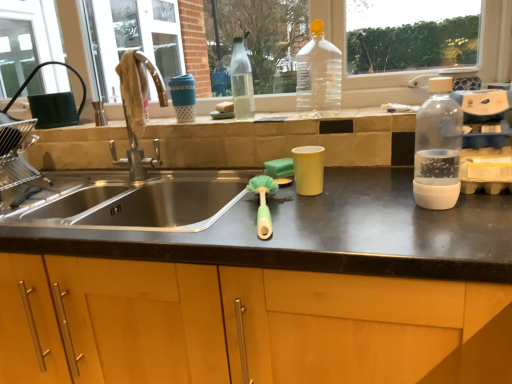
Find the location of a particular element. This screenshot has height=384, width=512. vacant point to the left of transparent plastic bottle at right, acting as the third bottle starting from the left is located at coordinates (361, 214).